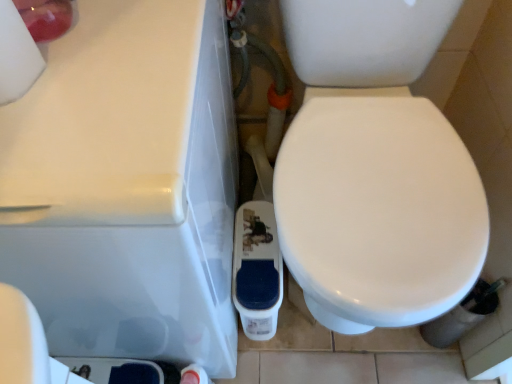
What do you see at coordinates (16, 55) in the screenshot? I see `white matte toilet paper at upper left` at bounding box center [16, 55].

What is the approximate height of white matte toilet paper at upper left?

It is 22.34 centimeters.

Where is `white glossy porcelain at center`? white glossy porcelain at center is located at coordinates (127, 186).

Which is nearer, (366, 227) or (31, 56)?

The point (31, 56) is closer.

Is there a large distance between white glossy bidet at center and white matte toilet paper at upper left?

white glossy bidet at center is near white matte toilet paper at upper left, not far away.

Can you confirm if white glossy bidet at center is shorter than white matte toilet paper at upper left?

In fact, white glossy bidet at center may be taller than white matte toilet paper at upper left.

Relative to white matte toilet paper at upper left, is white glossy bidet at center in front or behind?

white glossy bidet at center is positioned farther from the viewer than white matte toilet paper at upper left.

From the picture: Does white glossy porcelain at center appear on the right side of white glossy bidet at center?

Incorrect, white glossy porcelain at center is not on the right side of white glossy bidet at center.

Is white glossy porcelain at center next to white glossy bidet at center?

No, white glossy porcelain at center is not making contact with white glossy bidet at center.

Which of these two, white glossy porcelain at center or white glossy bidet at center, is wider?

With larger width is white glossy bidet at center.

What's the angular difference between white glossy porcelain at center and white glossy bidet at center's facing directions?

The angle between the facing direction of white glossy porcelain at center and the facing direction of white glossy bidet at center is 0.474 degrees.

Is white matte toilet paper at upper left with white glossy bidet at center?

No.

From the image's perspective, is white matte toilet paper at upper left above white glossy bidet at center?

Yes.

Is white glossy bidet at center located within white matte toilet paper at upper left?

No, white glossy bidet at center is not inside white matte toilet paper at upper left.

Consider the image. Considering the relative sizes of white matte toilet paper at upper left and white glossy bidet at center in the image provided, is white matte toilet paper at upper left bigger than white glossy bidet at center?

No.

Is white glossy porcelain at center to the right of white matte toilet paper at upper left from the viewer's perspective?

Yes, white glossy porcelain at center is to the right of white matte toilet paper at upper left.

Can you confirm if white glossy porcelain at center is shorter than white matte toilet paper at upper left?

In fact, white glossy porcelain at center may be taller than white matte toilet paper at upper left.

Would you consider white glossy porcelain at center to be distant from white matte toilet paper at upper left?

Actually, white glossy porcelain at center and white matte toilet paper at upper left are a little close together.

Find the location of a particular element. Image resolution: width=512 pixels, height=384 pixels. toilet paper on the left of white glossy porcelain at center is located at coordinates (16, 55).

How much distance is there between white glossy bidet at center and white glossy porcelain at center?

white glossy bidet at center and white glossy porcelain at center are 11.39 inches apart from each other.

From a real-world perspective, is white glossy bidet at center on top of white glossy porcelain at center?

No, from a real-world perspective, white glossy bidet at center is not over white glossy porcelain at center

Based on the photo, considering the positions of objects white glossy bidet at center and white glossy porcelain at center in the image provided, who is in front, white glossy bidet at center or white glossy porcelain at center?

white glossy bidet at center is more forward.

Is point (435, 133) closer to camera compared to point (148, 164)?

No, (435, 133) is behind (148, 164).

Who is more distant, white matte toilet paper at upper left or white glossy porcelain at center?

white glossy porcelain at center is behind.

Considering the sizes of white matte toilet paper at upper left and white glossy porcelain at center in the image, is white matte toilet paper at upper left wider or thinner than white glossy porcelain at center?

Considering their sizes, white matte toilet paper at upper left looks slimmer than white glossy porcelain at center.

From the image's perspective, is white matte toilet paper at upper left located above white glossy porcelain at center?

Indeed, from the image's perspective, white matte toilet paper at upper left is shown above white glossy porcelain at center.

Could you tell me if white matte toilet paper at upper left is turned towards white glossy porcelain at center?

No, white matte toilet paper at upper left is not facing towards white glossy porcelain at center.

Locate an element on the screen. This screenshot has width=512, height=384. bidet behind the white matte toilet paper at upper left is located at coordinates (378, 211).

Locate an element on the screen. The image size is (512, 384). bidet in front of the white glossy porcelain at center is located at coordinates (378, 211).

From the image, which object appears to be nearer to white matte toilet paper at upper left, white glossy bidet at center or white glossy porcelain at center?

white glossy porcelain at center.

Considering their positions, is white matte toilet paper at upper left positioned closer to white glossy porcelain at center than white glossy bidet at center?

Based on the image, white matte toilet paper at upper left appears to be nearer to white glossy porcelain at center.

From the image, which object appears to be nearer to white glossy porcelain at center, white glossy bidet at center or white matte toilet paper at upper left?

white matte toilet paper at upper left lies closer to white glossy porcelain at center than the other object.

When comparing their distances from white matte toilet paper at upper left, does white glossy porcelain at center or white glossy bidet at center seem further?

Among the two, white glossy bidet at center is located further to white matte toilet paper at upper left.

Considering their positions, is white matte toilet paper at upper left positioned closer to white glossy bidet at center than white glossy porcelain at center?

white glossy porcelain at center is positioned closer to the anchor white glossy bidet at center.

Consider the image. Which object lies further to the anchor point white glossy bidet at center, white glossy porcelain at center or white matte toilet paper at upper left?

white matte toilet paper at upper left is further to white glossy bidet at center.

The width and height of the screenshot is (512, 384). Find the location of `porcelain situated between white matte toilet paper at upper left and white glossy bidet at center from left to right`. porcelain situated between white matte toilet paper at upper left and white glossy bidet at center from left to right is located at coordinates (127, 186).